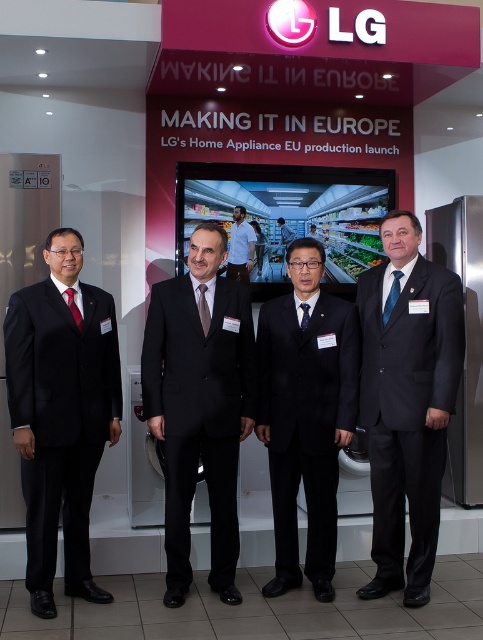
Does black suit at center come behind matte red tie at center?

Yes, it is behind matte red tie at center.

Is black suit at center taller than matte red tie at center?

Indeed, black suit at center has a greater height compared to matte red tie at center.

The height and width of the screenshot is (640, 483). Find the location of `black suit at center`. black suit at center is located at coordinates (199, 404).

You are a GUI agent. You are given a task and a screenshot of the screen. Output one action in this format:
    pyautogui.click(x=<x>, y=<y>)
    Task: Click on the black suit at center
    Image resolution: width=483 pixels, height=640 pixels.
    Given the screenshot: What is the action you would take?
    pyautogui.click(x=199, y=404)

Can you confirm if brown silk tie at center is bigger than matte red tie at center?

Actually, brown silk tie at center might be smaller than matte red tie at center.

Is brown silk tie at center further to the viewer compared to matte red tie at center?

That is True.

This screenshot has height=640, width=483. In order to click on brown silk tie at center in this screenshot , I will do `click(203, 308)`.

Is matte black suit at left positioned at the back of black matte suit at center?

That is False.

Who is positioned more to the left, matte black suit at left or black matte suit at center?

matte black suit at left is more to the left.

Describe the element at coordinates (60, 413) in the screenshot. I see `matte black suit at left` at that location.

Find the location of `matte black suit at left`. matte black suit at left is located at coordinates (60, 413).